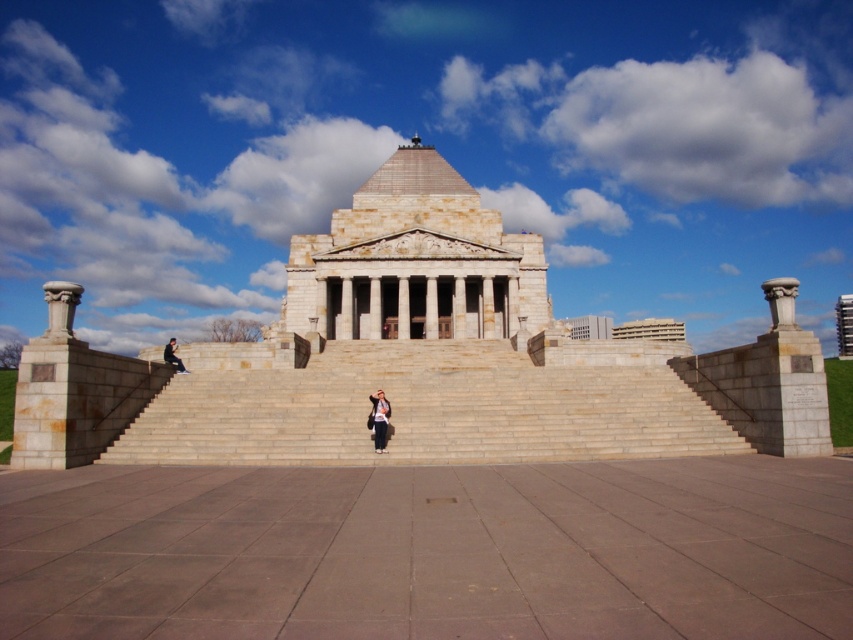
Question: Among these points, which one is nearest to the camera?

Choices:
 (A) 180,369
 (B) 376,436

Answer: (B)

Question: Is smooth stone column at right bigger than blurred denim jacket at lower left?

Choices:
 (A) no
 (B) yes

Answer: (B)

Question: Which point is farther to the camera?

Choices:
 (A) (62, 296)
 (B) (778, 276)
 (C) (608, 396)
 (D) (384, 403)

Answer: (B)

Question: Where is denim jacket at center located in relation to blurred denim jacket at lower left in the image?

Choices:
 (A) left
 (B) right

Answer: (B)

Question: Can you confirm if smooth stone column at right is positioned above denim jacket at center?

Choices:
 (A) yes
 (B) no

Answer: (A)

Question: Which object appears farthest from the camera in this image?

Choices:
 (A) denim jacket at center
 (B) blurred denim jacket at lower left
 (C) beige stone stairs at center

Answer: (B)